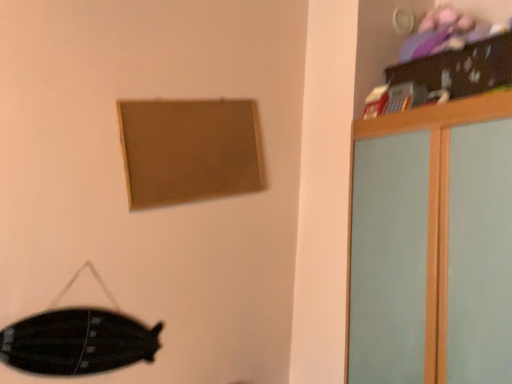
Question: Does black matte swivel chair at lower left appear on the right side of matte brown picture frame at upper center?

Choices:
 (A) no
 (B) yes

Answer: (A)

Question: Is black matte swivel chair at lower left to the left of matte brown picture frame at upper center from the viewer's perspective?

Choices:
 (A) no
 (B) yes

Answer: (B)

Question: Are black matte swivel chair at lower left and matte brown picture frame at upper center beside each other?

Choices:
 (A) no
 (B) yes

Answer: (A)

Question: Is matte brown picture frame at upper center a part of black matte swivel chair at lower left?

Choices:
 (A) no
 (B) yes

Answer: (A)

Question: Is black matte swivel chair at lower left wider than matte brown picture frame at upper center?

Choices:
 (A) no
 (B) yes

Answer: (A)

Question: Is black matte swivel chair at lower left positioned before matte brown picture frame at upper center?

Choices:
 (A) yes
 (B) no

Answer: (A)

Question: Can you confirm if light wood dresser at upper right is taller than matte brown picture frame at upper center?

Choices:
 (A) no
 (B) yes

Answer: (B)

Question: Can you confirm if light wood dresser at upper right is thinner than matte brown picture frame at upper center?

Choices:
 (A) no
 (B) yes

Answer: (A)

Question: Is the position of light wood dresser at upper right more distant than that of matte brown picture frame at upper center?

Choices:
 (A) no
 (B) yes

Answer: (A)

Question: Considering the relative sizes of light wood dresser at upper right and matte brown picture frame at upper center in the image provided, is light wood dresser at upper right bigger than matte brown picture frame at upper center?

Choices:
 (A) yes
 (B) no

Answer: (A)

Question: Can we say light wood dresser at upper right lies outside matte brown picture frame at upper center?

Choices:
 (A) yes
 (B) no

Answer: (A)

Question: Does light wood dresser at upper right come in front of matte brown picture frame at upper center?

Choices:
 (A) yes
 (B) no

Answer: (A)

Question: Is black matte swivel chair at lower left directly adjacent to light wood dresser at upper right?

Choices:
 (A) yes
 (B) no

Answer: (B)